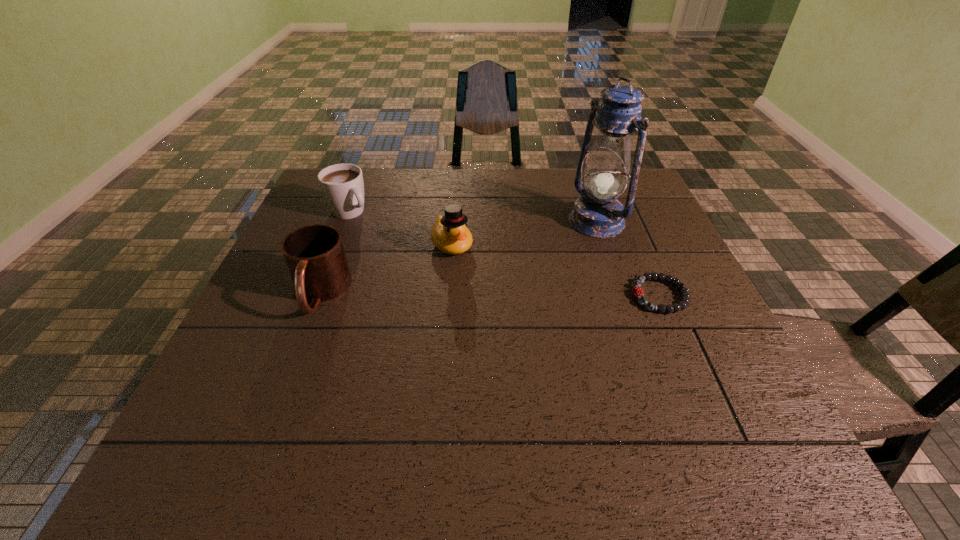
Find the location of `free space on the desktop that is between the mug and the shortest object and is positioned with the handle on the side of the cappuccino`. free space on the desktop that is between the mug and the shortest object and is positioned with the handle on the side of the cappuccino is located at coordinates (461, 294).

Where is `vacant space on the desktop that is between the mug and the bracelet and is positioned on the front-facing side of the duck`? The width and height of the screenshot is (960, 540). vacant space on the desktop that is between the mug and the bracelet and is positioned on the front-facing side of the duck is located at coordinates (490, 294).

Locate an element on the screen. This screenshot has width=960, height=540. vacant space on the desktop that is between the mug and the shortest object and is positioned on the front-facing side of the tallest object is located at coordinates tap(444, 294).